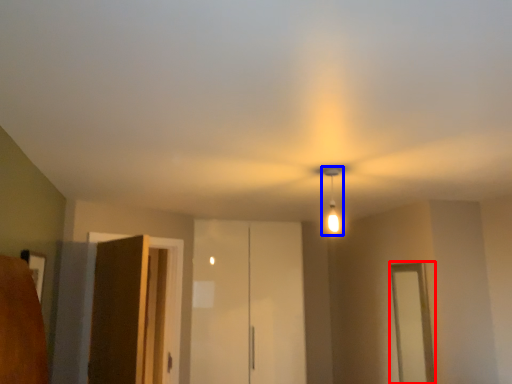
Question: Which of the following is the closest to the observer, window (highlighted by a red box) or light fixture (highlighted by a blue box)?

Choices:
 (A) window
 (B) light fixture

Answer: (B)